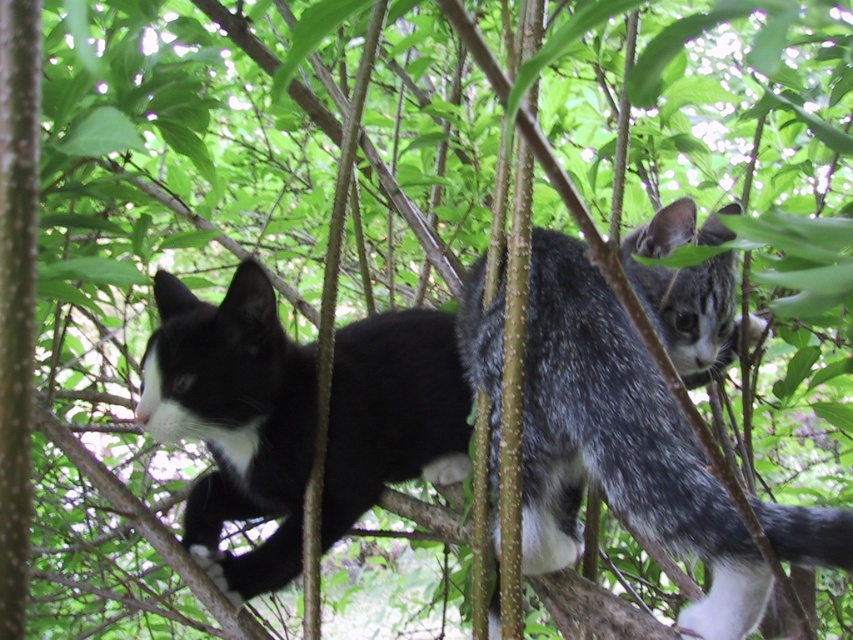
Question: Can you confirm if gray speckled fur cat at upper right is positioned to the left of black fur cat at left?

Choices:
 (A) no
 (B) yes

Answer: (A)

Question: Is gray speckled fur cat at upper right positioned before black fur cat at left?

Choices:
 (A) no
 (B) yes

Answer: (B)

Question: Which point appears closest to the camera in this image?

Choices:
 (A) (357, 444)
 (B) (537, 269)

Answer: (B)

Question: Which point is closer to the camera?

Choices:
 (A) black fur cat at left
 (B) gray speckled fur cat at upper right

Answer: (B)

Question: Does gray speckled fur cat at upper right appear on the left side of black fur cat at left?

Choices:
 (A) no
 (B) yes

Answer: (A)